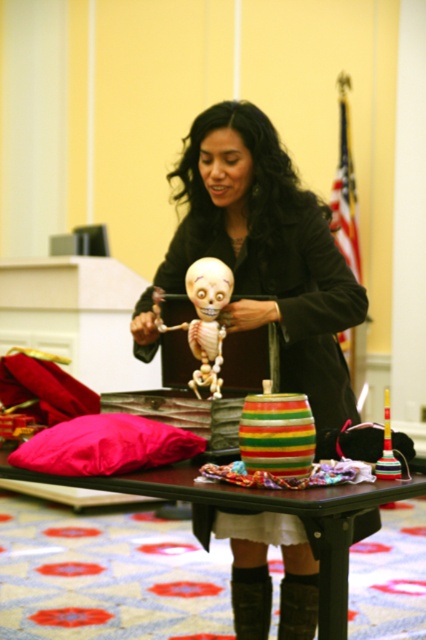
What object is located at the coordinates point (252, 609)?

The object at point (252, 609) is the black leather boot at lower center.

What is the position of the matte black jacket at center in the image?

The matte black jacket at center is located at point (267,250).

From the picture: You are a tailor who needs to determine if the matte black jacket at center can be placed over the smooth beige skeleton at center without covering its arms. Based on the provided description, can the jacket accommodate the skeleton?

The matte black jacket at center is wider than the smooth beige skeleton at center, so the jacket can accommodate the skeleton without covering its arms.